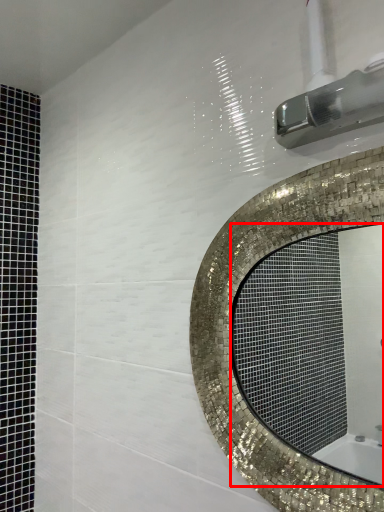
Question: In this image, where is mirror (annotated by the red box) located relative to shower?

Choices:
 (A) right
 (B) left

Answer: (B)